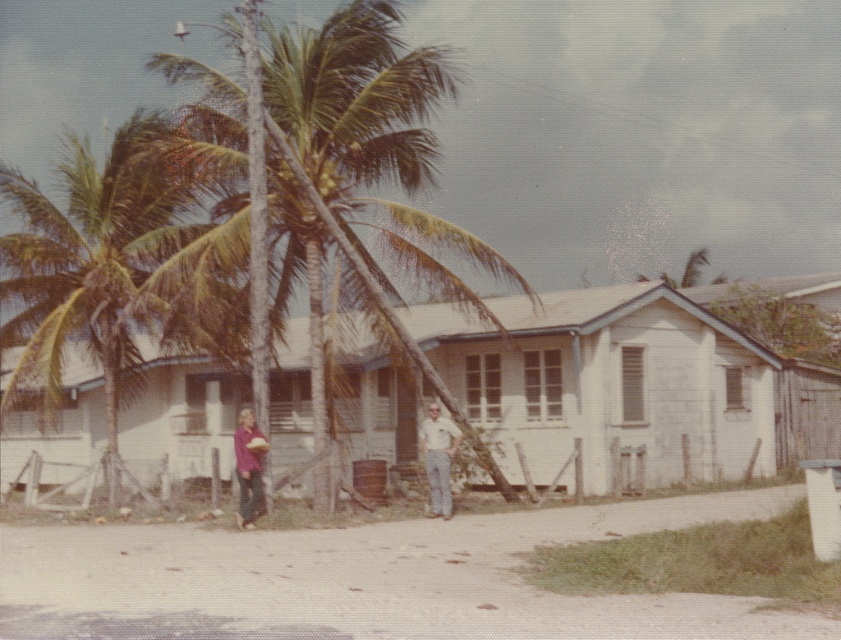
You are a visitor to this tropical house and want to know which tree is closer to the front door. The two trees are the green leafy palm tree at center and the green leafy coconut tree at center. Based on their positions, which one is closer to the front door?

The green leafy palm tree at center is positioned under the green leafy coconut tree at center, meaning the palm tree is closer to the front door since it is in front of the coconut tree.

You are standing at the origin point in this image. You want to walk to the white wood house at center. Which direction should you move in to reach it?

Since the white wood house at center is located at coordinates approximately 0.609 on the x axis and 0.749 on the y axis, you should move towards the right and upwards from your current position at the origin to reach it.

You are a visitor arriving at the tropical location and see the white wood house at center and the matte purple shirt at center. Which object is positioned to the right side from your viewpoint?

The white wood house at center is to the right of the matte purple shirt at center, so the white wood house at center is positioned to the right side from your viewpoint.